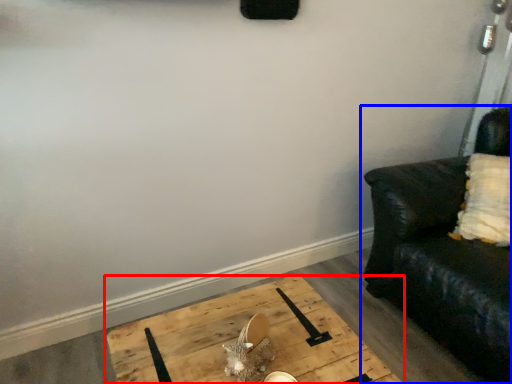
Question: Which point is closer to the camera, table (highlighted by a red box) or studio couch (highlighted by a blue box)?

Choices:
 (A) table
 (B) studio couch

Answer: (A)